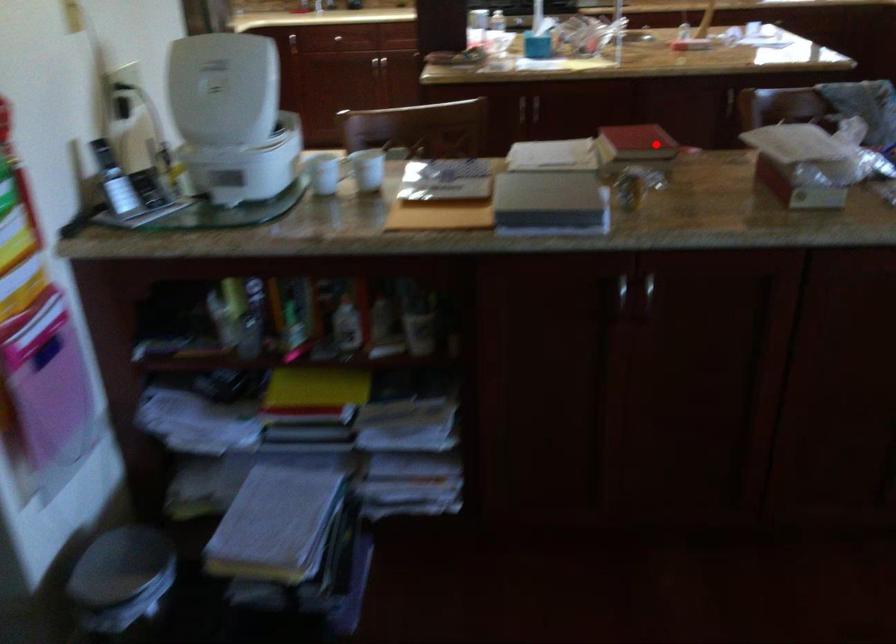
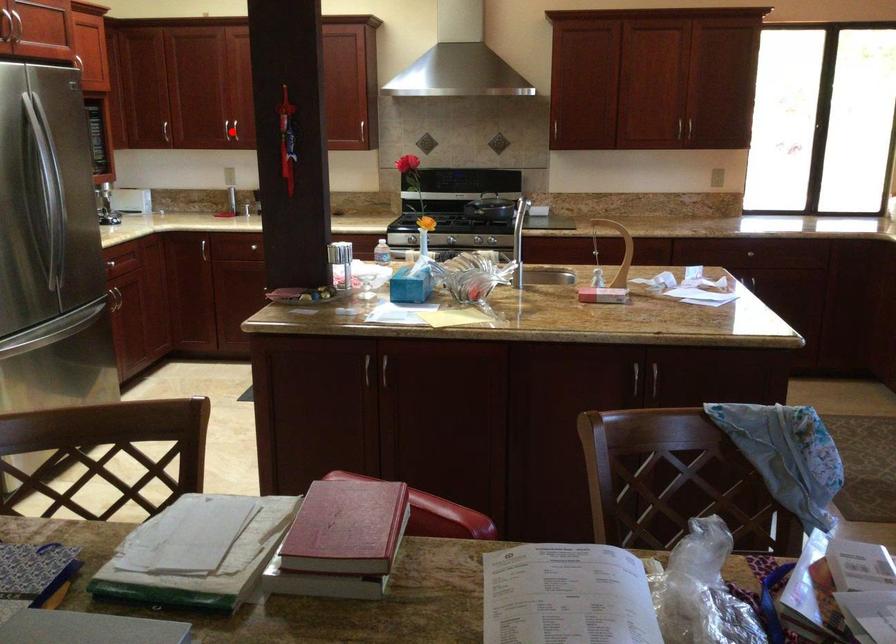
I am providing you with two images of the same scene from different viewpoints. A red point is marked on the first image and another point is marked on the second image. Are the points marked in image1 and image2 representing the same 3D position?

No